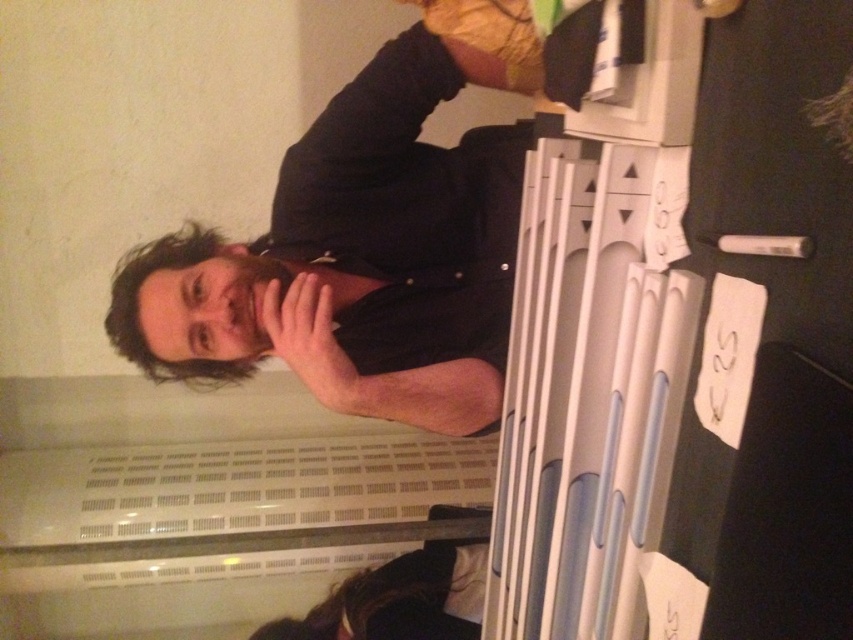
Does point (271, 221) come farther from viewer compared to point (120, 300)?

Yes.

Between black matte shirt at center and dark brown hair at upper left, which one appears on the left side from the viewer's perspective?

Positioned to the left is dark brown hair at upper left.

Identify the location of black matte shirt at center. The height and width of the screenshot is (640, 853). (357, 257).